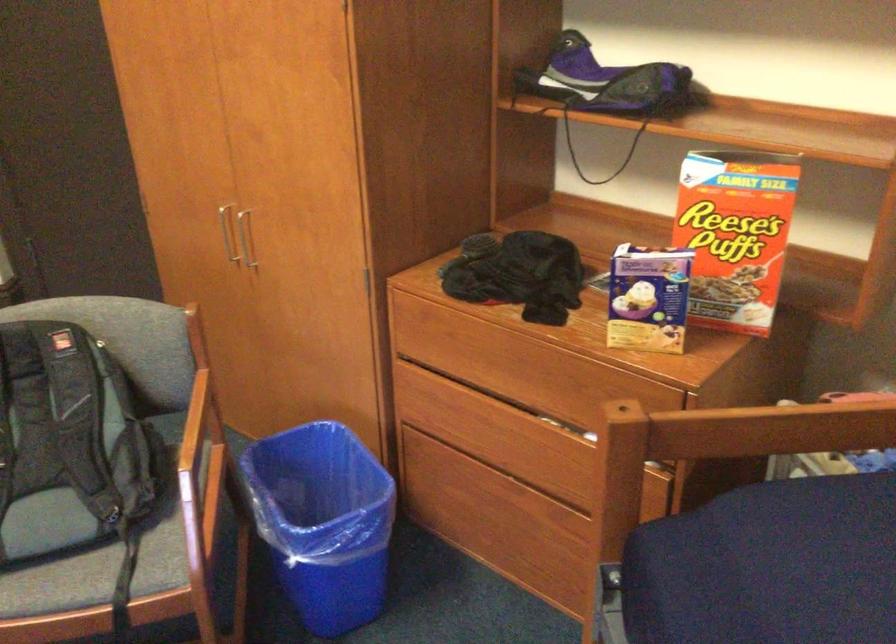
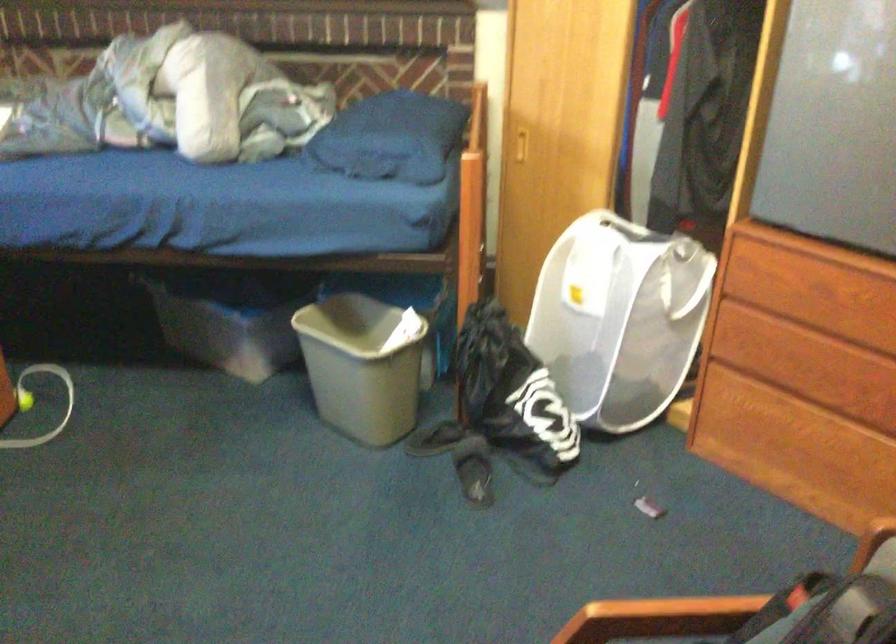
Based on the photo, first-person continuous shooting, in which direction is the camera rotating?

The rotation direction of the camera is left-down.